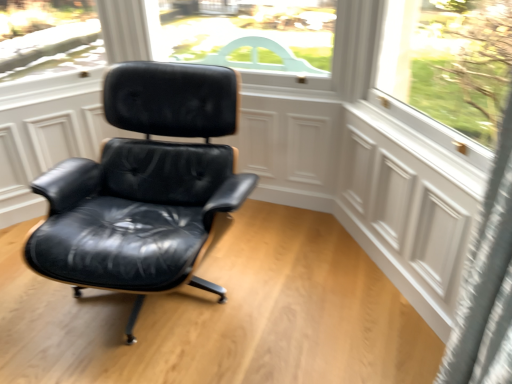
Question: Considering the relative sizes of black leather chair at center and white matte screen door at right in the image provided, is black leather chair at center taller than white matte screen door at right?

Choices:
 (A) no
 (B) yes

Answer: (B)

Question: Is black leather chair at center outside white matte screen door at right?

Choices:
 (A) yes
 (B) no

Answer: (A)

Question: Are black leather chair at center and white matte screen door at right located far from each other?

Choices:
 (A) yes
 (B) no

Answer: (B)

Question: Is black leather chair at center with white matte screen door at right?

Choices:
 (A) yes
 (B) no

Answer: (B)

Question: Considering the relative sizes of black leather chair at center and white matte screen door at right in the image provided, is black leather chair at center bigger than white matte screen door at right?

Choices:
 (A) no
 (B) yes

Answer: (B)

Question: From a real-world perspective, is black leather chair at center physically below white matte screen door at right?

Choices:
 (A) yes
 (B) no

Answer: (B)

Question: Is white matte screen door at right positioned with its back to black leather chair at center?

Choices:
 (A) no
 (B) yes

Answer: (A)

Question: Considering the relative sizes of white matte screen door at right and black leather chair at center in the image provided, is white matte screen door at right wider than black leather chair at center?

Choices:
 (A) no
 (B) yes

Answer: (A)

Question: From the image's perspective, is white matte screen door at right located beneath black leather chair at center?

Choices:
 (A) yes
 (B) no

Answer: (A)

Question: Can you confirm if white matte screen door at right is positioned to the right of black leather chair at center?

Choices:
 (A) no
 (B) yes

Answer: (B)

Question: Is white matte screen door at right located outside black leather chair at center?

Choices:
 (A) no
 (B) yes

Answer: (B)

Question: From the image's perspective, is white matte screen door at right on black leather chair at center?

Choices:
 (A) yes
 (B) no

Answer: (B)

Question: Do you think black leather chair at center is within white matte screen door at right, or outside of it?

Choices:
 (A) inside
 (B) outside

Answer: (B)